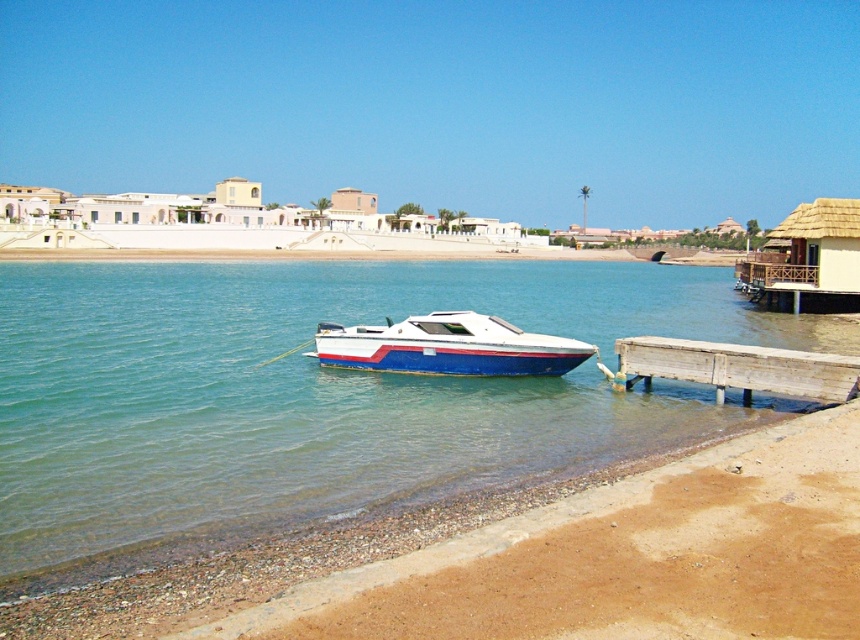
Question: Which object is closer to the camera taking this photo?

Choices:
 (A) wooden dock at lower right
 (B) blue glossy water at center
 (C) white glossy boat at center

Answer: (B)

Question: Can you confirm if blue glossy water at center is positioned to the left of white glossy boat at center?

Choices:
 (A) yes
 (B) no

Answer: (B)

Question: From the image, what is the correct spatial relationship of blue glossy water at center in relation to wooden dock at lower right?

Choices:
 (A) left
 (B) right

Answer: (B)

Question: Is blue glossy water at center below wooden dock at lower right?

Choices:
 (A) yes
 (B) no

Answer: (B)

Question: Which is nearer to the white glossy boat at center?

Choices:
 (A) wooden dock at lower right
 (B) blue glossy water at center

Answer: (A)

Question: Estimate the real-world distances between objects in this image. Which object is closer to the white glossy boat at center?

Choices:
 (A) wooden dock at lower right
 (B) blue glossy water at center

Answer: (A)